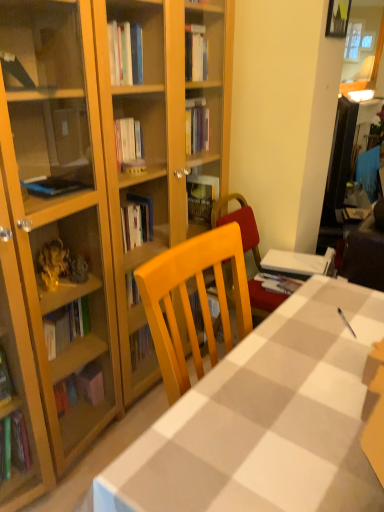
Question: From a real-world perspective, is wooden picture frame at upper right positioned above or below white checkered tablecloth at center?

Choices:
 (A) above
 (B) below

Answer: (A)

Question: From the image's perspective, relative to white checkered tablecloth at center, is wooden picture frame at upper right above or below?

Choices:
 (A) above
 (B) below

Answer: (A)

Question: Considering the positions of wooden picture frame at upper right and white checkered tablecloth at center in the image, is wooden picture frame at upper right taller or shorter than white checkered tablecloth at center?

Choices:
 (A) short
 (B) tall

Answer: (A)

Question: Would you say white checkered tablecloth at center is to the left or to the right of wooden picture frame at upper right in the picture?

Choices:
 (A) right
 (B) left

Answer: (B)

Question: Looking at their shapes, would you say white checkered tablecloth at center is wider or thinner than wooden picture frame at upper right?

Choices:
 (A) wide
 (B) thin

Answer: (A)

Question: Relative to wooden picture frame at upper right, is white checkered tablecloth at center in front or behind?

Choices:
 (A) behind
 (B) front

Answer: (B)

Question: Is point (117, 478) positioned closer to the camera than point (336, 9)?

Choices:
 (A) farther
 (B) closer

Answer: (B)